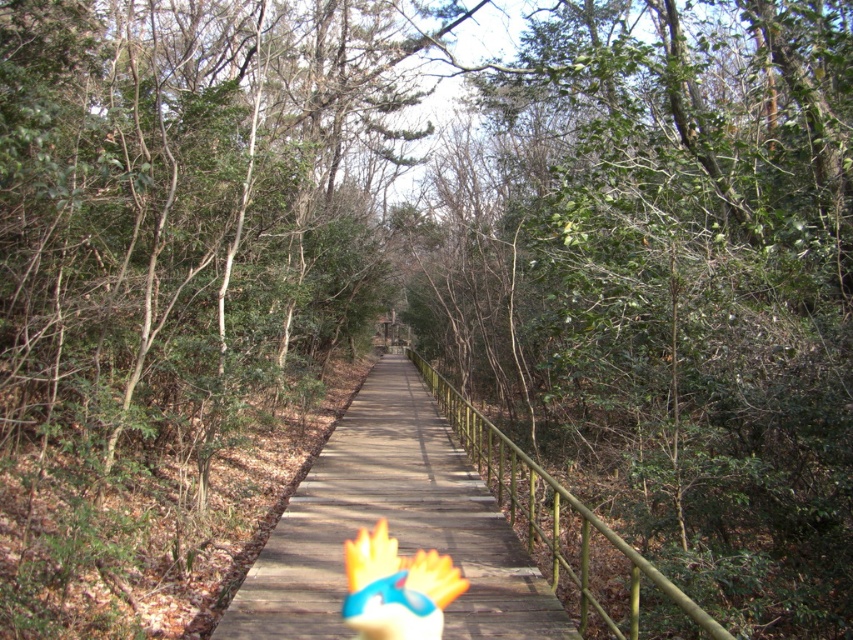
Can you confirm if wooden boardwalk at center is thinner than flame-patterned plastic toy at center?

No.

Measure the distance between point [309,584] and camera.

They are 5.23 meters apart.

Locate an element on the screen. Image resolution: width=853 pixels, height=640 pixels. wooden boardwalk at center is located at coordinates (392, 525).